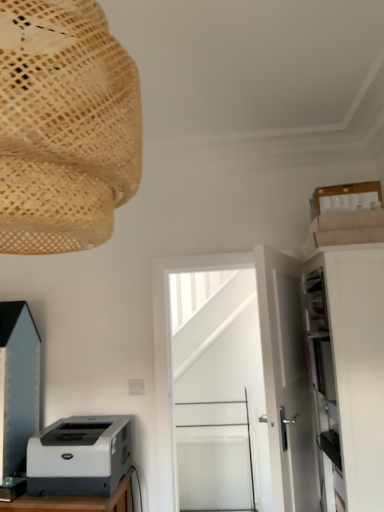
Question: Is white matte door at center, which is the 1th door in back-to-front order, outside natural woven lampshade at upper left?

Choices:
 (A) yes
 (B) no

Answer: (A)

Question: Does white matte door at center, which is the 1th door in back-to-front order, have a greater width compared to natural woven lampshade at upper left?

Choices:
 (A) yes
 (B) no

Answer: (B)

Question: Is natural woven lampshade at upper left at the back of white matte door at center, which is the second door from front to back?

Choices:
 (A) no
 (B) yes

Answer: (A)

Question: Considering the relative sizes of white matte door at center, which is the 1th door in back-to-front order, and natural woven lampshade at upper left in the image provided, is white matte door at center, which is the 1th door in back-to-front order, thinner than natural woven lampshade at upper left?

Choices:
 (A) no
 (B) yes

Answer: (B)

Question: Is white matte door at center, which is the 1th door in back-to-front order, behind natural woven lampshade at upper left?

Choices:
 (A) yes
 (B) no

Answer: (A)

Question: Does white matte door at center, which is the 1th door in back-to-front order, lie in front of natural woven lampshade at upper left?

Choices:
 (A) yes
 (B) no

Answer: (B)

Question: From a real-world perspective, does white matte door at center, which is the second door from front to back, sit lower than matte black cabinet at lower left, which ranks as the 2th cabinetry in right-to-left order?

Choices:
 (A) yes
 (B) no

Answer: (A)

Question: From the image's perspective, is white matte door at center, which is the second door from front to back, below matte black cabinet at lower left, the first cabinetry in the left-to-right sequence?

Choices:
 (A) no
 (B) yes

Answer: (B)

Question: Is white matte door at center, which is the 1th door in back-to-front order, to the left of matte black cabinet at lower left, the first cabinetry in the left-to-right sequence, from the viewer's perspective?

Choices:
 (A) yes
 (B) no

Answer: (B)

Question: Is white matte door at center, which is the second door from front to back, positioned with its back to matte black cabinet at lower left, which ranks as the 2th cabinetry in right-to-left order?

Choices:
 (A) no
 (B) yes

Answer: (A)

Question: Could you tell me if white matte door at center, which is the 1th door in back-to-front order, is turned towards matte black cabinet at lower left, the first cabinetry in the left-to-right sequence?

Choices:
 (A) yes
 (B) no

Answer: (B)

Question: Is white matte door at center, which is the 1th door in back-to-front order, beside matte black cabinet at lower left, the first cabinetry in the left-to-right sequence?

Choices:
 (A) yes
 (B) no

Answer: (B)

Question: Considering the relative sizes of white plastic printer at lower left and white matte door at center, marked as the first door in a front-to-back arrangement, in the image provided, is white plastic printer at lower left taller than white matte door at center, marked as the first door in a front-to-back arrangement,?

Choices:
 (A) no
 (B) yes

Answer: (A)